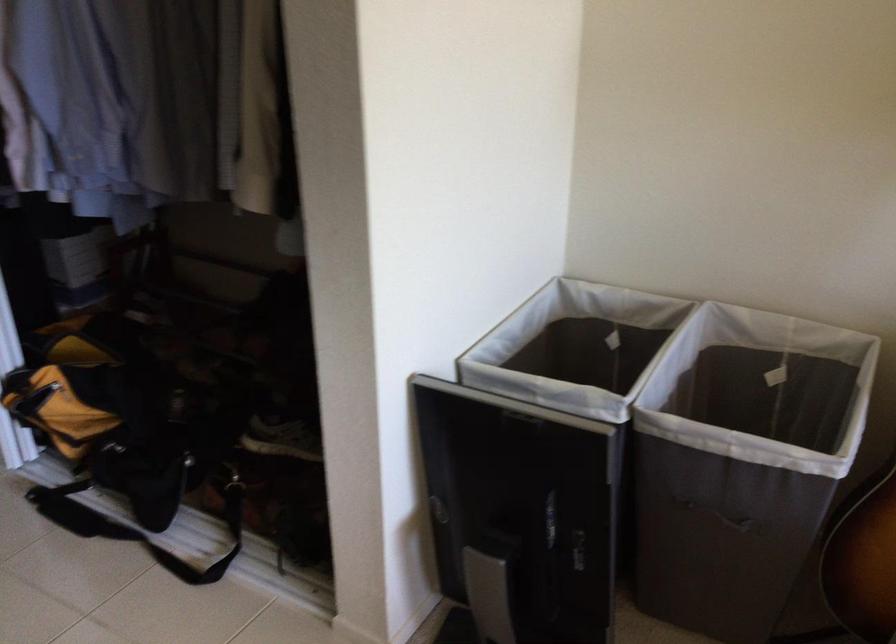
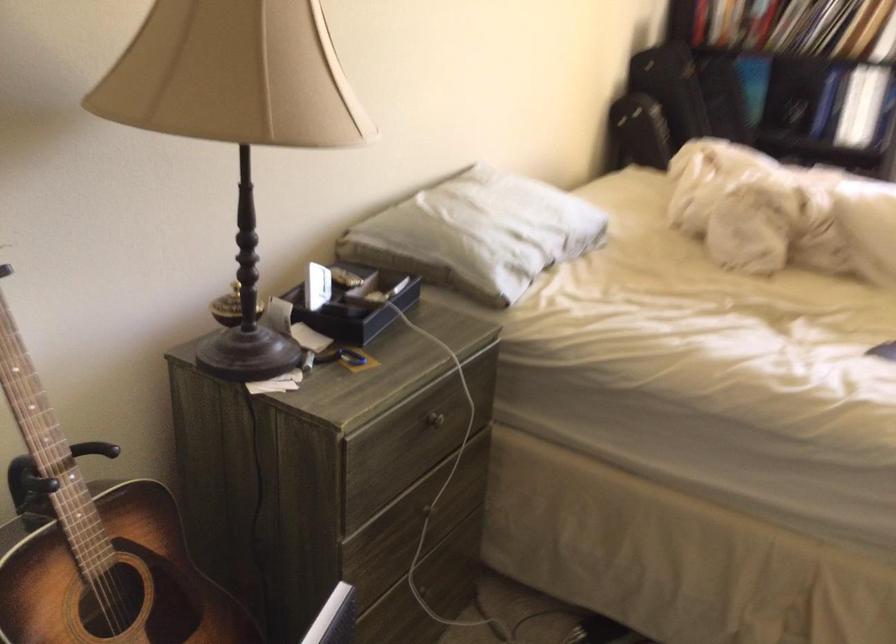
How did the camera likely rotate?

The camera's rotation is toward right-down.